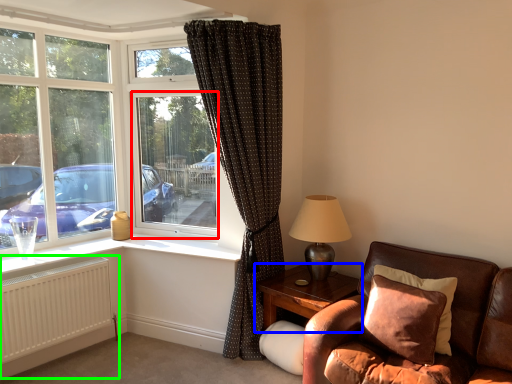
Question: Based on their relative distances, which object is farther from window screen (highlighted by a red box)? Choose from table (highlighted by a blue box) and radiator (highlighted by a green box).

Choices:
 (A) table
 (B) radiator

Answer: (A)